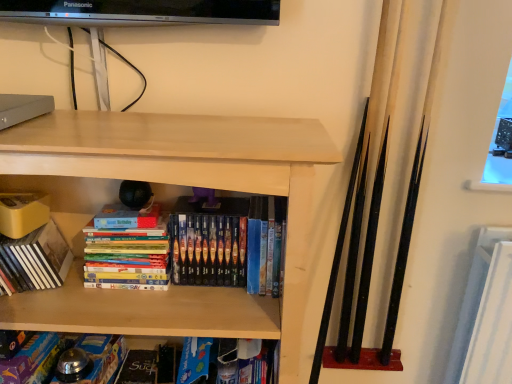
What do you see at coordinates (176, 184) in the screenshot? The width and height of the screenshot is (512, 384). I see `light wood shelf at center` at bounding box center [176, 184].

Where is `matte yellow book at left, arranged as the 1th book when viewed from the left`? This screenshot has height=384, width=512. matte yellow book at left, arranged as the 1th book when viewed from the left is located at coordinates (37, 258).

Identify the location of hardcover books at center, which is counted as the 4th book, starting from the left. The image size is (512, 384). (189, 249).

Consider the image. In terms of width, does multicolored cardboard books at center, placed as the third book when sorted from left to right, look wider or thinner when compared to matte black paperback book at lower center?

multicolored cardboard books at center, placed as the third book when sorted from left to right, is thinner than matte black paperback book at lower center.

From the picture: In terms of size, does multicolored cardboard books at center, which is the 2th book in right-to-left order, appear bigger or smaller than matte black paperback book at lower center?

In the image, multicolored cardboard books at center, which is the 2th book in right-to-left order, appears to be larger than matte black paperback book at lower center.

Choose the correct answer: Is multicolored cardboard books at center, placed as the third book when sorted from left to right, inside matte black paperback book at lower center or outside it?

The correct answer is: outside.

Does multicolored cardboard books at center, placed as the third book when sorted from left to right, lie behind matte black paperback book at lower center?

No, multicolored cardboard books at center, placed as the third book when sorted from left to right, is closer to the camera.

Based on their positions, is hardcover books at center, which is counted as the 4th book, starting from the left, located to the left or right of blue cardboard book at lower center, arranged as the 2th book when viewed from the left?

In the image, hardcover books at center, which is counted as the 4th book, starting from the left, appears on the right side of blue cardboard book at lower center, arranged as the 2th book when viewed from the left.

In the scene shown: Is blue cardboard book at lower center, arranged as the 2th book when viewed from the left, at the back of hardcover books at center, which appears as the 1th book when viewed from the right?

No, hardcover books at center, which appears as the 1th book when viewed from the right,'s orientation is not away from blue cardboard book at lower center, arranged as the 2th book when viewed from the left.

Considering the relative sizes of hardcover books at center, which appears as the 1th book when viewed from the right, and blue cardboard book at lower center, the third book positioned from the right, in the image provided, is hardcover books at center, which appears as the 1th book when viewed from the right, taller than blue cardboard book at lower center, the third book positioned from the right,?

Yes.

Could you measure the distance between hardcover books at center, which appears as the 1th book when viewed from the right, and blue cardboard book at lower center, the third book positioned from the right?

hardcover books at center, which appears as the 1th book when viewed from the right, and blue cardboard book at lower center, the third book positioned from the right, are 13.81 inches apart from each other.

Is point (141, 232) less distant than point (146, 255)?

That is True.

Which is more to the right, multicolored cardboard books at center, which is the 2th book in right-to-left order, or hardcover books at center, which appears as the 1th book when viewed from the right?

hardcover books at center, which appears as the 1th book when viewed from the right.

Is multicolored cardboard books at center, which is the 2th book in right-to-left order, touching hardcover books at center, which is counted as the 4th book, starting from the left?

Absolutely, multicolored cardboard books at center, which is the 2th book in right-to-left order, is next to and touching hardcover books at center, which is counted as the 4th book, starting from the left.

Is multicolored cardboard books at center, placed as the third book when sorted from left to right, inside the boundaries of hardcover books at center, which is counted as the 4th book, starting from the left, or outside?

multicolored cardboard books at center, placed as the third book when sorted from left to right, is spatially situated outside hardcover books at center, which is counted as the 4th book, starting from the left.

Is blue cardboard book at lower center, arranged as the 2th book when viewed from the left, with hardcover books at center, which is counted as the 4th book, starting from the left?

No.

This screenshot has width=512, height=384. I want to click on the 1st book in front when counting from the blue cardboard book at lower center, the third book positioned from the right, so click(x=189, y=249).

Does blue cardboard book at lower center, the third book positioned from the right, have a smaller size compared to hardcover books at center, which appears as the 1th book when viewed from the right?

Yes.

From the picture: From the image's perspective, is blue cardboard book at lower center, arranged as the 2th book when viewed from the left, below hardcover books at center, which is counted as the 4th book, starting from the left?

Yes, from the image's perspective, blue cardboard book at lower center, arranged as the 2th book when viewed from the left, is below hardcover books at center, which is counted as the 4th book, starting from the left.

Is point (243, 245) farther from viewer compared to point (34, 232)?

No, (243, 245) is closer to viewer.

At what (x,y) coordinates should I click in order to perform the action: click on the 2nd book positioned above the matte yellow book at left, arranged as the 1th book when viewed from the left (from the image's perspective). Please return your answer as a coordinate pair (x, y). The height and width of the screenshot is (384, 512). Looking at the image, I should click on (189, 249).

Would you say matte yellow book at left, arranged as the 1th book when viewed from the left, is part of hardcover books at center, which is counted as the 4th book, starting from the left,'s contents?

No, matte yellow book at left, arranged as the 1th book when viewed from the left, is not surrounded by hardcover books at center, which is counted as the 4th book, starting from the left.

Is matte yellow book at left, arranged as the 1th book when viewed from the left, thinner than light wood shelf at center?

Indeed, matte yellow book at left, arranged as the 1th book when viewed from the left, has a lesser width compared to light wood shelf at center.

Between point (61, 256) and point (297, 368), which one is positioned behind?

The point (61, 256) is behind.

In order to click on shelf that appears below the matte yellow book at left, arranged as the 1th book when viewed from the left (from a real-world perspective) in this screenshot , I will do `click(176, 184)`.

Is matte yellow book at left, arranged as the 1th book when viewed from the left, looking in the opposite direction of light wood shelf at center?

Yes, matte yellow book at left, arranged as the 1th book when viewed from the left,'s orientation is away from light wood shelf at center.

Between blue cardboard book at lower center, the third book positioned from the right, and matte yellow book at left, arranged as the 1th book when viewed from the left, which one is positioned in front?

matte yellow book at left, arranged as the 1th book when viewed from the left, is closer to the camera.

Do you think blue cardboard book at lower center, the third book positioned from the right, is within matte yellow book at left, which is counted as the fourth book, starting from the right, or outside of it?

blue cardboard book at lower center, the third book positioned from the right, is not inside matte yellow book at left, which is counted as the fourth book, starting from the right, it's outside.

Is blue cardboard book at lower center, the third book positioned from the right, touching matte yellow book at left, which is counted as the fourth book, starting from the right?

No, blue cardboard book at lower center, the third book positioned from the right, is not beside matte yellow book at left, which is counted as the fourth book, starting from the right.

Where is `paperback book to the right of multicolored cardboard books at center, which is the 2th book in right-to-left order`? This screenshot has height=384, width=512. paperback book to the right of multicolored cardboard books at center, which is the 2th book in right-to-left order is located at coordinates (138, 367).

Starting from the hardcover books at center, which is counted as the 4th book, starting from the left, which book is the 2nd one to the left? Please provide its 2D coordinates.

[(33, 360)]

Consider the image. Based on their spatial positions, is blue cardboard book at lower center, arranged as the 2th book when viewed from the left, or matte black paperback book at lower center further from hardcover books at center, which appears as the 1th book when viewed from the right?

matte black paperback book at lower center is positioned further to the anchor hardcover books at center, which appears as the 1th book when viewed from the right.

Based on their spatial positions, is hardcover books at center, which is counted as the 4th book, starting from the left, or matte yellow book at left, which is counted as the fourth book, starting from the right, further from light wood shelf at center?

matte yellow book at left, which is counted as the fourth book, starting from the right.

Looking at the image, which one is located closer to hardcover books at center, which appears as the 1th book when viewed from the right, light wood shelf at center or matte black paperback book at lower center?

light wood shelf at center is closer to hardcover books at center, which appears as the 1th book when viewed from the right.

Looking at the image, which one is located further to matte black paperback book at lower center, blue cardboard book at lower center, arranged as the 2th book when viewed from the left, or multicolored cardboard books at center, placed as the third book when sorted from left to right?

multicolored cardboard books at center, placed as the third book when sorted from left to right, lies further to matte black paperback book at lower center than the other object.

From the image, which object appears to be nearer to blue cardboard book at lower center, the third book positioned from the right, light wood shelf at center or matte black paperback book at lower center?

matte black paperback book at lower center.

Looking at the image, which one is located closer to light wood shelf at center, multicolored cardboard books at center, placed as the third book when sorted from left to right, or blue cardboard book at lower center, the third book positioned from the right?

The object closer to light wood shelf at center is multicolored cardboard books at center, placed as the third book when sorted from left to right.

Which object lies further to the anchor point multicolored cardboard books at center, placed as the third book when sorted from left to right, matte yellow book at left, which is counted as the fourth book, starting from the right, or matte black paperback book at lower center?

matte black paperback book at lower center is further to multicolored cardboard books at center, placed as the third book when sorted from left to right.

Considering their positions, is hardcover books at center, which is counted as the 4th book, starting from the left, positioned further to multicolored cardboard books at center, which is the 2th book in right-to-left order, than matte black paperback book at lower center?

matte black paperback book at lower center is positioned further to the anchor multicolored cardboard books at center, which is the 2th book in right-to-left order.

This screenshot has width=512, height=384. Identify the location of shelf between multicolored cardboard books at center, placed as the third book when sorted from left to right, and matte black paperback book at lower center in the up-down direction. (176, 184).

At what (x,y) coordinates should I click in order to perform the action: click on book situated between light wood shelf at center and hardcover books at center, which is counted as the 4th book, starting from the left, from left to right. Please return your answer as a coordinate pair (x, y). The image size is (512, 384). Looking at the image, I should click on (128, 255).

Identify the location of shelf between hardcover books at center, which appears as the 1th book when viewed from the right, and matte black paperback book at lower center, in the vertical direction. (176, 184).

Locate an element on the screen. This screenshot has height=384, width=512. shelf that lies between matte yellow book at left, which is counted as the fourth book, starting from the right, and blue cardboard book at lower center, arranged as the 2th book when viewed from the left, from top to bottom is located at coordinates (176, 184).